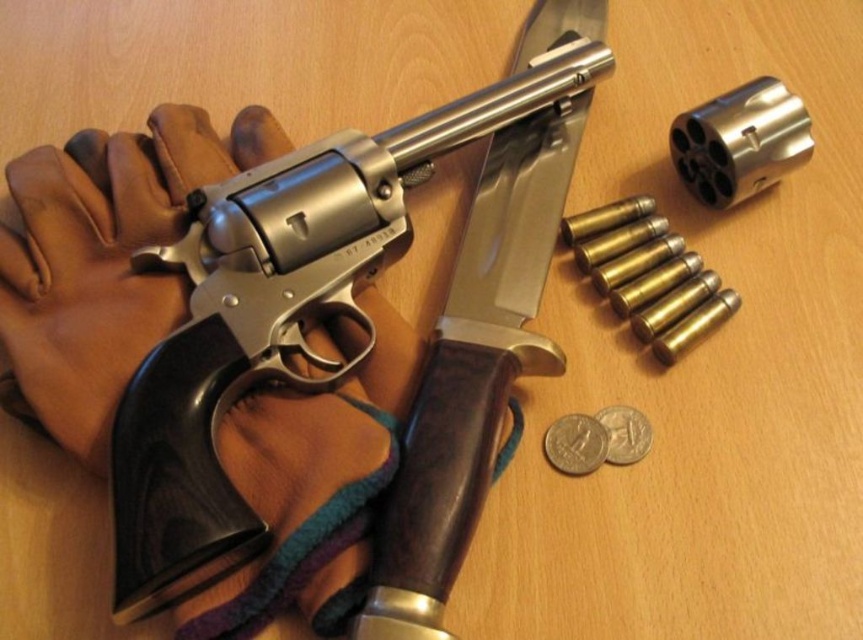
Question: Is brown leather glove at left smaller than silver metallic coin at lower right?

Choices:
 (A) yes
 (B) no

Answer: (B)

Question: Can you confirm if brown leather glove at left is wider than silver metallic coin at lower center?

Choices:
 (A) no
 (B) yes

Answer: (B)

Question: Does polished metal revolver at center appear on the left side of silver metallic coin at lower center?

Choices:
 (A) no
 (B) yes

Answer: (B)

Question: Which object is farther from the camera taking this photo?

Choices:
 (A) polished metal revolver at center
 (B) brown leather glove at left
 (C) silver metallic coin at lower center

Answer: (C)

Question: Considering the real-world distances, which object is farthest from the polished metal revolver at center?

Choices:
 (A) silver metallic coin at lower right
 (B) brown leather glove at left
 (C) silver metallic coin at lower center

Answer: (A)

Question: Which object is closer to the camera taking this photo?

Choices:
 (A) silver metallic coin at lower right
 (B) brown leather glove at left
 (C) polished metal revolver at center
 (D) silver metallic coin at lower center

Answer: (C)